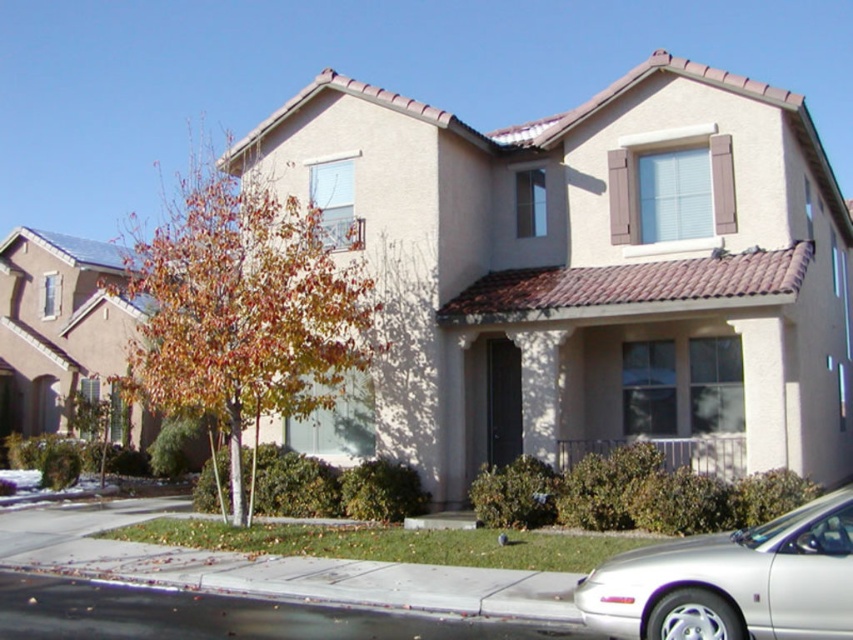
Does silver metallic sedan at lower right have a smaller size compared to black asphalt curb at lower left?

No.

Who is higher up, silver metallic sedan at lower right or black asphalt curb at lower left?

silver metallic sedan at lower right is higher up.

Where is `silver metallic sedan at lower right`? silver metallic sedan at lower right is located at coordinates (733, 580).

Find the location of `autumn leaves at left`. autumn leaves at left is located at coordinates (242, 312).

Does autumn leaves at left have a lesser height compared to black asphalt curb at lower left?

Incorrect, autumn leaves at left's height does not fall short of black asphalt curb at lower left's.

Is point (231, 401) behind point (305, 563)?

Yes, it is.

Image resolution: width=853 pixels, height=640 pixels. Find the location of `autumn leaves at left`. autumn leaves at left is located at coordinates (242, 312).

Does autumn leaves at left appear on the right side of silver metallic sedan at lower right?

In fact, autumn leaves at left is to the left of silver metallic sedan at lower right.

Between autumn leaves at left and silver metallic sedan at lower right, which one appears on the right side from the viewer's perspective?

silver metallic sedan at lower right is more to the right.

Does point (236, 268) come behind point (751, 592)?

Yes, it is.

At what (x,y) coordinates should I click in order to perform the action: click on autumn leaves at left. Please return your answer as a coordinate pair (x, y). Image resolution: width=853 pixels, height=640 pixels. Looking at the image, I should click on (242, 312).